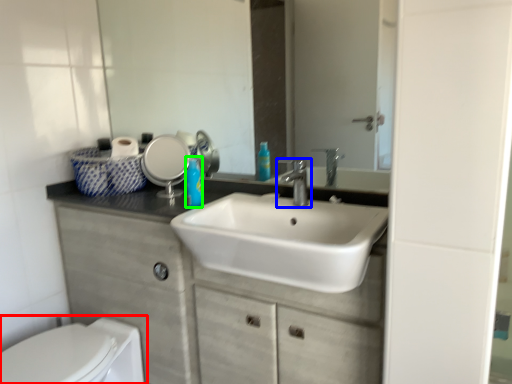
Question: Which is farther away from toilet (highlighted by a red box)? tap (highlighted by a blue box) or soap dispenser (highlighted by a green box)?

Choices:
 (A) tap
 (B) soap dispenser

Answer: (A)